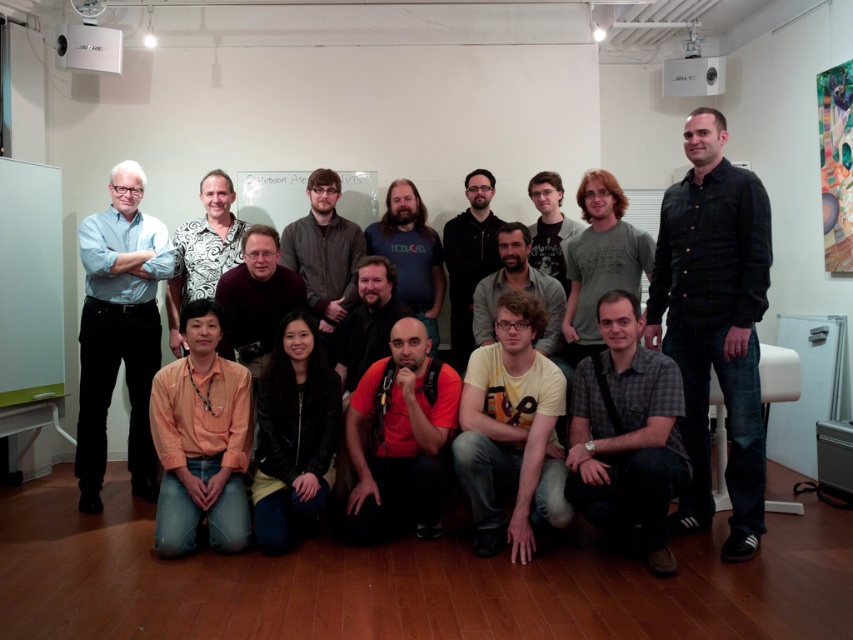
You are a photographer standing at the back of the room with a camera that has a maximum focus range of 20 inches. You want to take a photo of both the dark brown hair at center and the bearded man at center. Can you capture both subjects in focus without moving closer?

The distance between the dark brown hair at center and the bearded man at center is 20.26 inches. Since the camera can only focus up to 20 inches, the subjects are slightly out of the focus range. You might need to move closer or adjust your equipment to ensure both are in focus.

You are standing at the origin of the room. There are two points in the room labeled as point (x=393, y=248) and point (x=337, y=360). Which point is closer to you?

Point (x=337, y=360) is closer to you because it is in front of point (x=393, y=248).